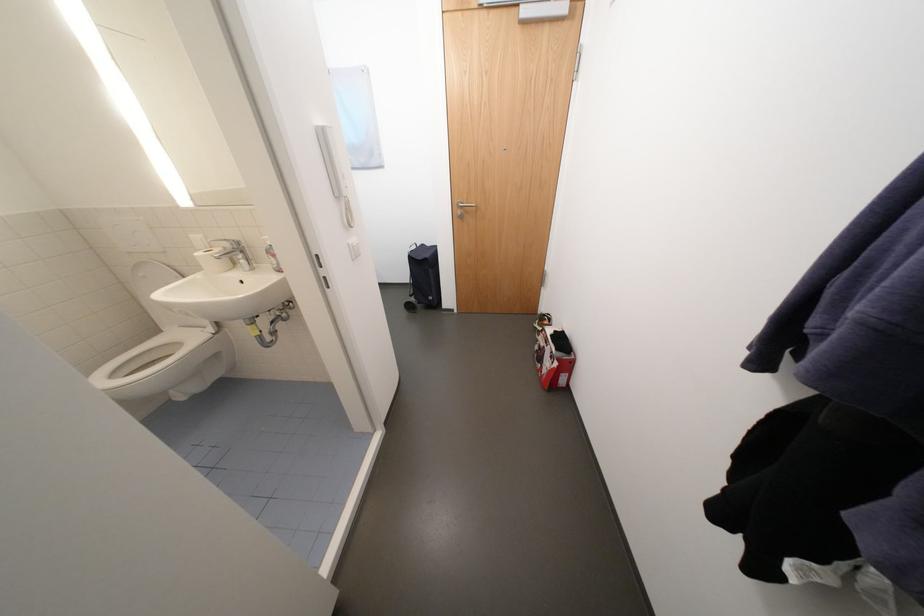
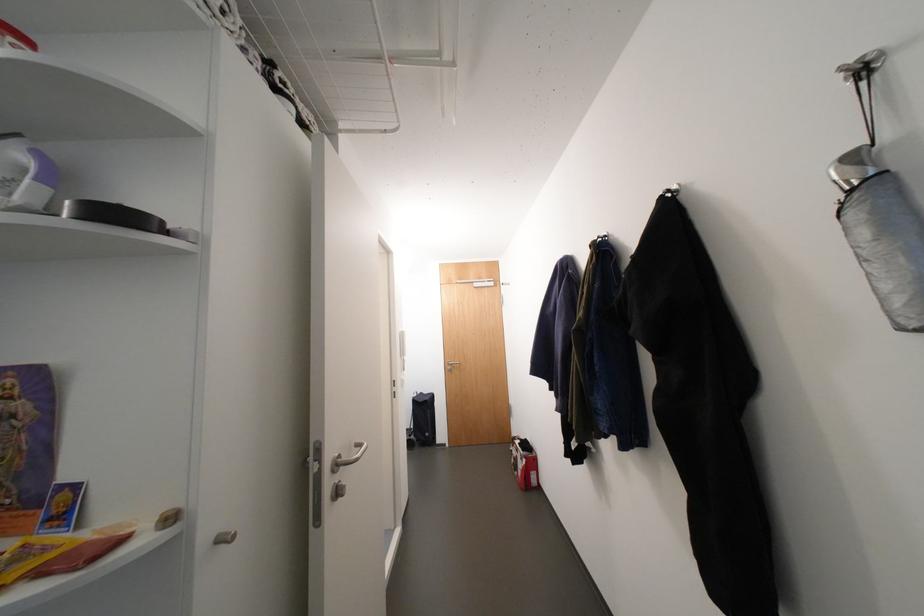
Locate, in the second image, the point that corresponds to (433,260) in the first image.

(433, 402)